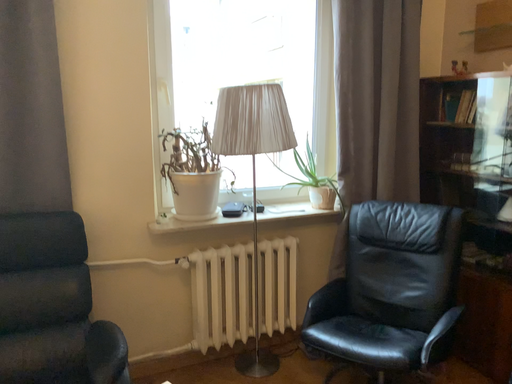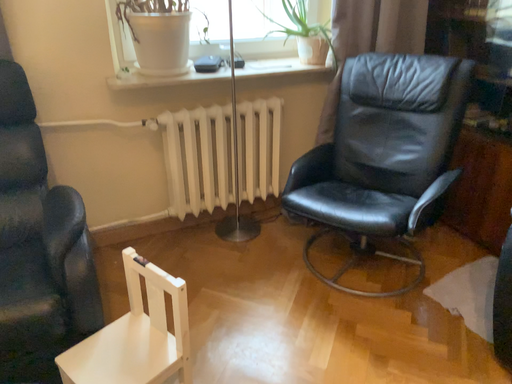
Question: How did the camera likely rotate when shooting the video?

Choices:
 (A) rotated upward
 (B) rotated downward

Answer: (B)